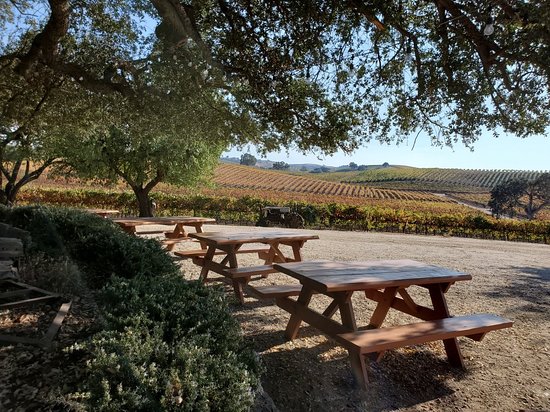
Identify the location of tables. This screenshot has width=550, height=412. (363, 266), (235, 234), (160, 220).